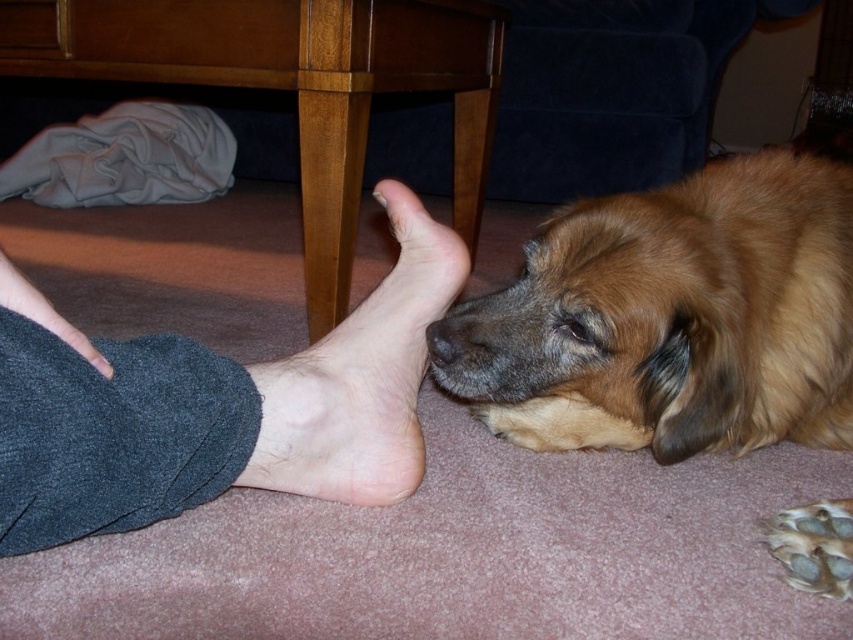
Question: Which point is farther to the camera?

Choices:
 (A) pink flesh at center
 (B) barefoot foot at lower left
 (C) skinny bare foot at lower left
 (D) white matte toe at center

Answer: (D)

Question: Which object appears farthest from the camera in this image?

Choices:
 (A) white matte toe at center
 (B) golden fur dog at lower right
 (C) skinny bare foot at lower left

Answer: (A)

Question: Is barefoot foot at lower left wider than pink flesh at center?

Choices:
 (A) yes
 (B) no

Answer: (A)

Question: Where is skinny bare foot at lower left located in relation to matte skin toe at lower center in the image?

Choices:
 (A) below
 (B) above

Answer: (A)

Question: Is black smooth nose at center positioned before white matte toe at center?

Choices:
 (A) yes
 (B) no

Answer: (A)

Question: Which is nearer to the golden fur dog at lower right?

Choices:
 (A) matte skin toe at lower center
 (B) black smooth nose at center

Answer: (B)